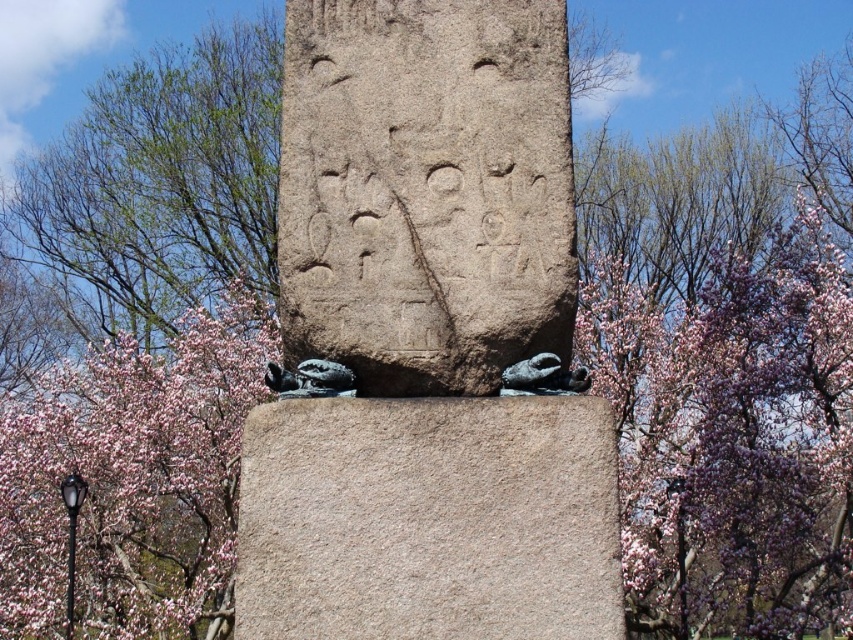
You are an archaeologist examining the image of the park. You need to determine the relative positions of the gray stone monument at center and the smooth gray stone at center. Which one is positioned to the left?

The gray stone monument at center is to the left of the smooth gray stone at center, so the gray stone monument at center is positioned to the left.

You are standing in front of the large stone obelisk in the park. There are two points marked on the obelisk. The first point is at coordinates point (401, 451) and the second is at point (187, 442). Which point is closer to you?

Point (401, 451) is closer to the camera than point (187, 442).

You are standing in the park and see the smooth gray stone at center and the pink blossom tree at center. Which object is located to the right of the other?

The smooth gray stone at center is positioned on the right side of pink blossom tree at center.